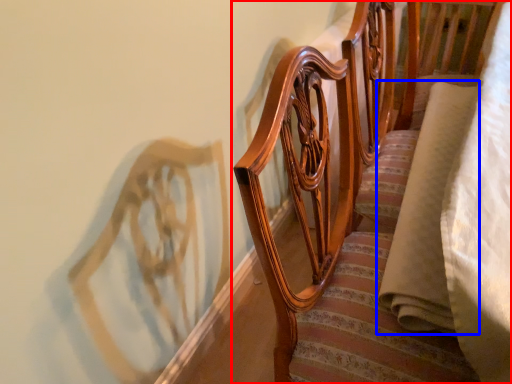
Question: Among these objects, which one is farthest to the camera, furniture (highlighted by a red box) or fabric (highlighted by a blue box)?

Choices:
 (A) furniture
 (B) fabric

Answer: (B)